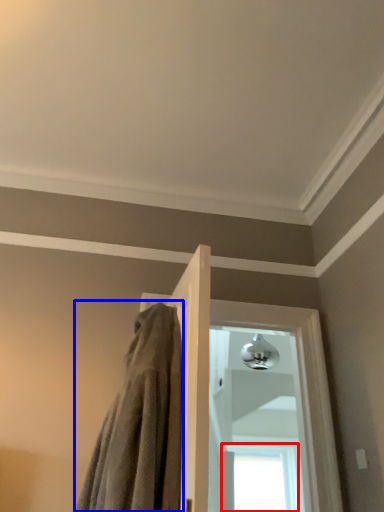
Question: Which point is closer to the camera, window (highlighted by a red box) or bath towel (highlighted by a blue box)?

Choices:
 (A) window
 (B) bath towel

Answer: (B)